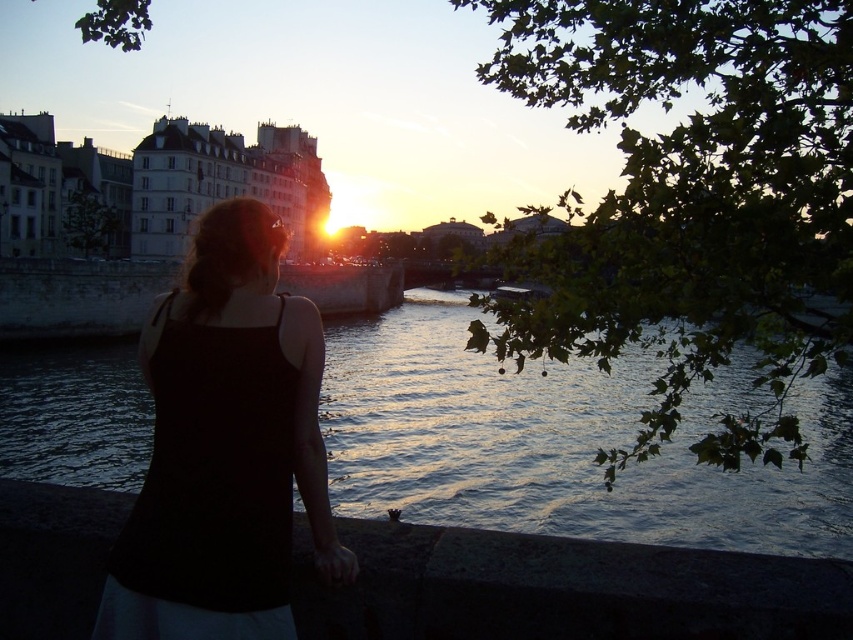
Question: Which object is farther from the camera taking this photo?

Choices:
 (A) black fabric dress at center
 (B) dark blue water at center
 (C) dark concrete ledge at lower center

Answer: (B)

Question: Is black fabric dress at center smaller than dark concrete ledge at lower center?

Choices:
 (A) no
 (B) yes

Answer: (A)

Question: Is dark blue water at center positioned before dark concrete ledge at lower center?

Choices:
 (A) no
 (B) yes

Answer: (A)

Question: Which point is closer to the camera taking this photo?

Choices:
 (A) (390, 310)
 (B) (96, 576)
 (C) (318, 522)

Answer: (B)

Question: Estimate the real-world distances between objects in this image. Which object is closer to the dark concrete ledge at lower center?

Choices:
 (A) dark blue water at center
 (B) black fabric dress at center

Answer: (B)

Question: In this image, where is black fabric dress at center located relative to dark concrete ledge at lower center?

Choices:
 (A) below
 (B) above

Answer: (B)